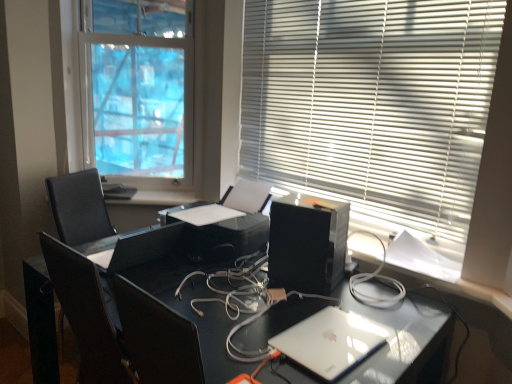
The width and height of the screenshot is (512, 384). In order to click on free space to the right of matte black monitor at center in this screenshot , I will do `click(187, 273)`.